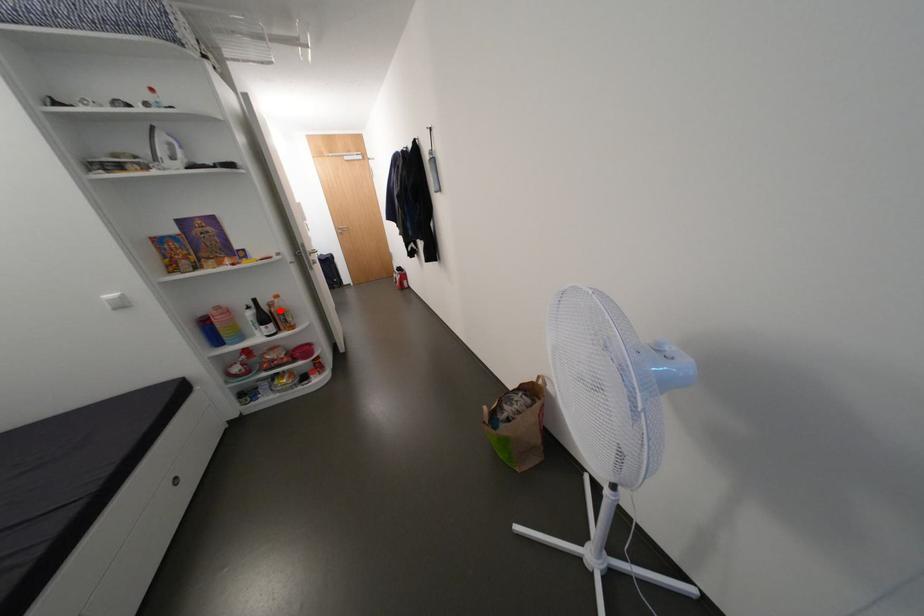
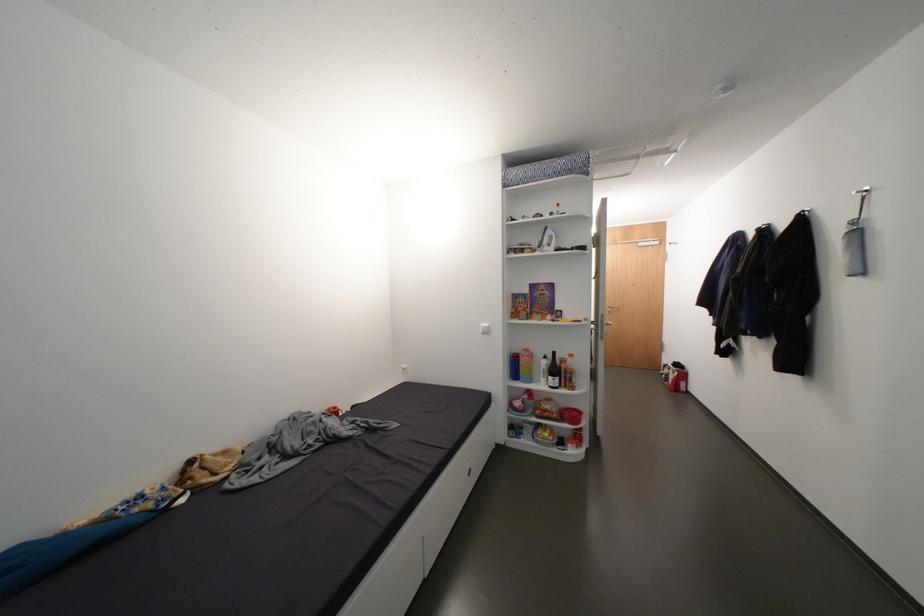
Find the pixel in the second image that matches the highlighted location in the first image.

(570, 367)